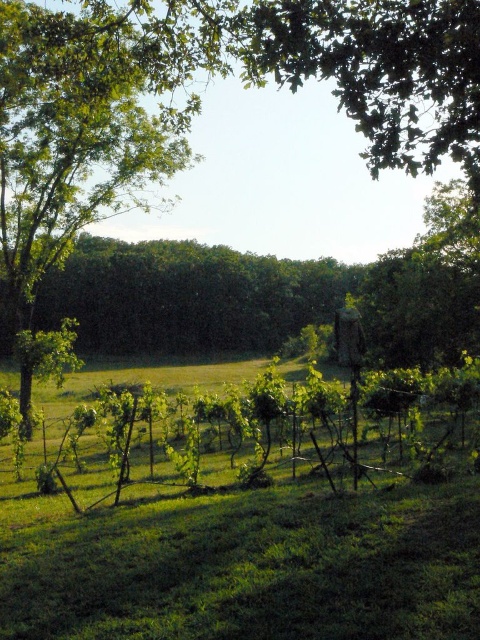
In the scene shown: You are a gardener assessing the growth of plants in the vineyard. Which of the two plants, the green leafy vines at center or the green leafy tree at left, requires more sunlight for healthy growth?

The green leafy vines at center requires more sunlight for healthy growth since they are smaller than the green leafy tree at left, which has grown taller in the available light.

You are standing at the point labeled as point (205,552) in the image. You want to walk directly towards the viewer. How far will you have to walk to reach the viewer?

The distance between point (205,552) and the viewer is 22.98 feet, so you will have to walk 22.98 feet to reach the viewer.

You are a gardener planning to water both the green leafy vines at center and the green leafy tree at left. Which one is closer to the left side of the image?

The green leafy tree at left is closer to the left side of the image since the green leafy vines at center are positioned to its right.